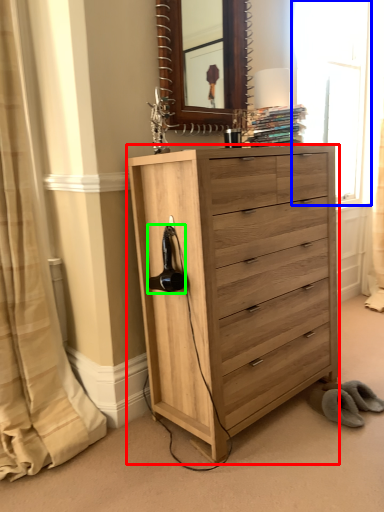
Question: Which is farther away from chest of drawers (highlighted by a red box)? window (highlighted by a blue box) or hair drier (highlighted by a green box)?

Choices:
 (A) window
 (B) hair drier

Answer: (A)